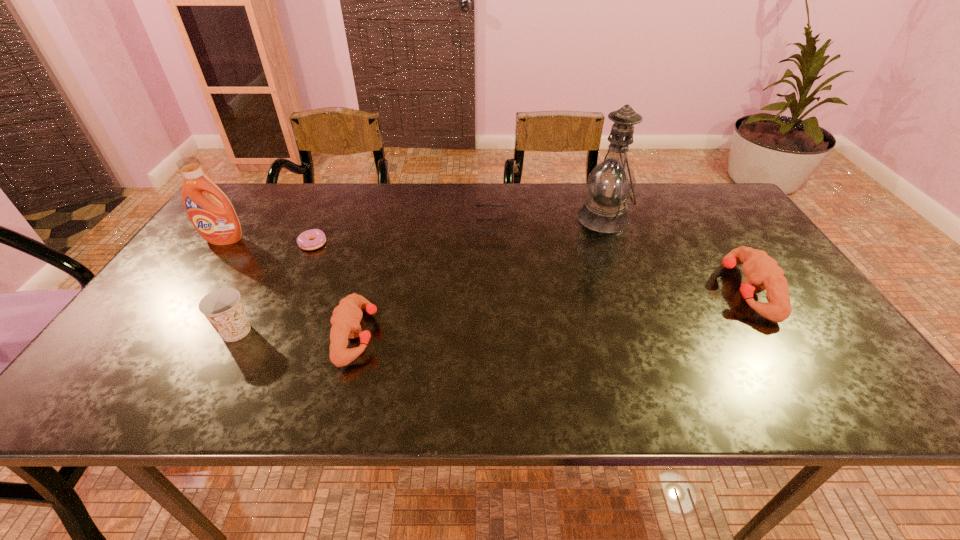
At what (x,y) coordinates should I click in order to perform the action: click on vacant space that's between the fifth object from left to right and the fifth object from right to left. Please return your answer as a coordinate pair (x, y). The width and height of the screenshot is (960, 540). Looking at the image, I should click on (404, 235).

At what (x,y) coordinates should I click in order to perform the action: click on vacant space that's between the sixth object from right to left and the shortest object. Please return your answer as a coordinate pair (x, y). The width and height of the screenshot is (960, 540). Looking at the image, I should click on (276, 288).

Find the location of a particular element. The height and width of the screenshot is (540, 960). free point between the second tallest object and the shorter puncher is located at coordinates (291, 287).

This screenshot has height=540, width=960. In order to click on free space that is in between the taller puncher and the Dixie cup in this screenshot , I will do `click(491, 311)`.

At what (x,y) coordinates should I click in order to perform the action: click on free space between the tallest object and the shortest object. Please return your answer as a coordinate pair (x, y). Looking at the image, I should click on (459, 231).

The height and width of the screenshot is (540, 960). I want to click on object that stands as the second closest to the detergent, so click(223, 308).

Image resolution: width=960 pixels, height=540 pixels. I want to click on object that ranks as the second closest to the shorter puncher, so click(x=304, y=240).

At what (x,y) coordinates should I click in order to perform the action: click on free location that satisfies the following two spatial constraints: 1. on the front-facing side of the leftmost object; 2. on the right side of the shortest object. Please return your answer as a coordinate pair (x, y). The height and width of the screenshot is (540, 960). Looking at the image, I should click on 221,244.

Locate an element on the screen. free space that satisfies the following two spatial constraints: 1. on the front-facing side of the detergent; 2. on the right side of the third object from left to right is located at coordinates (221, 244).